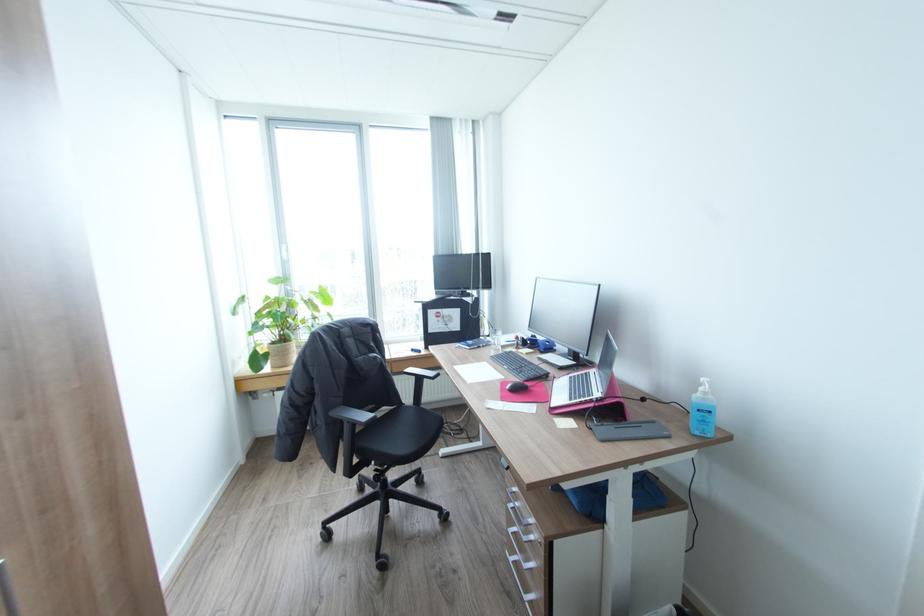
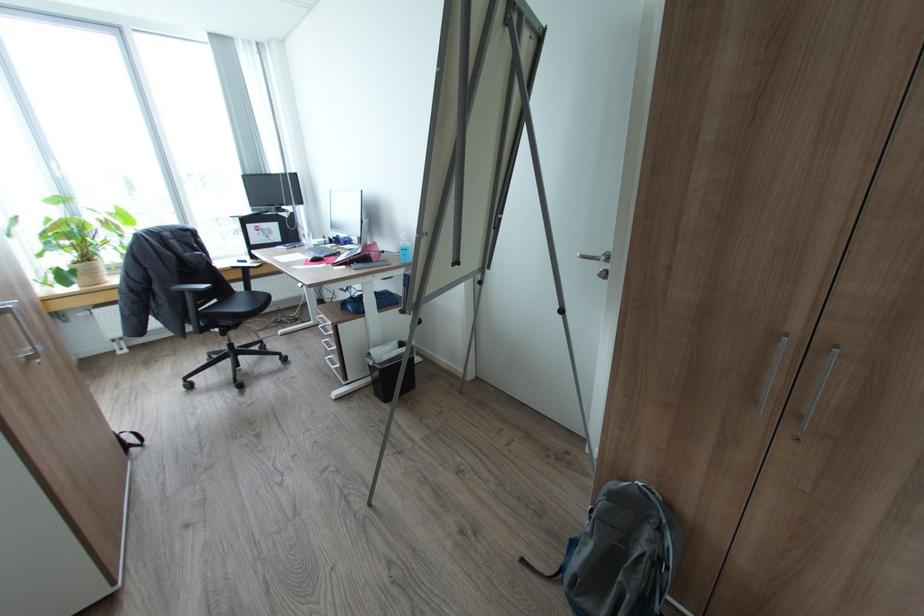
Find the pixel in the second image that matches [322,291] in the first image.

(119, 211)